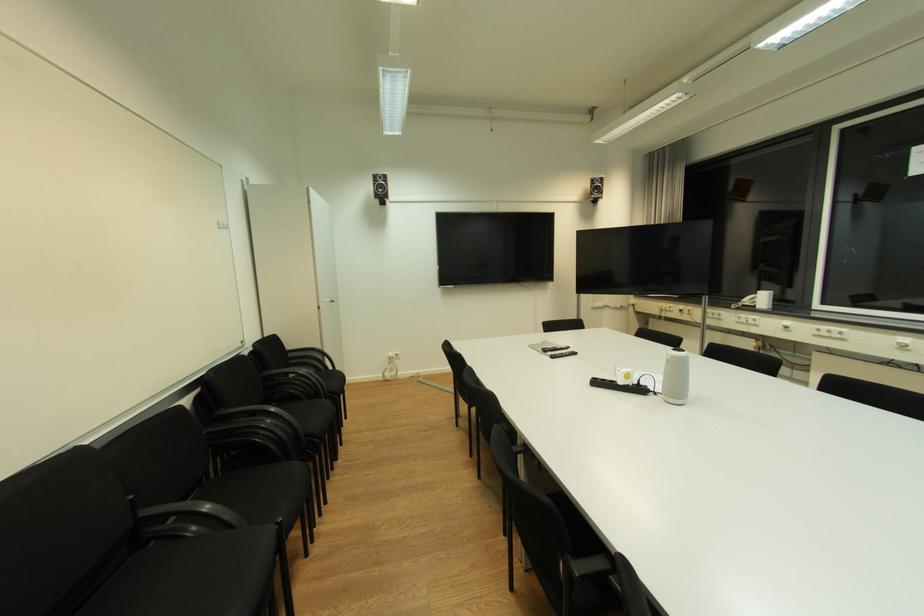
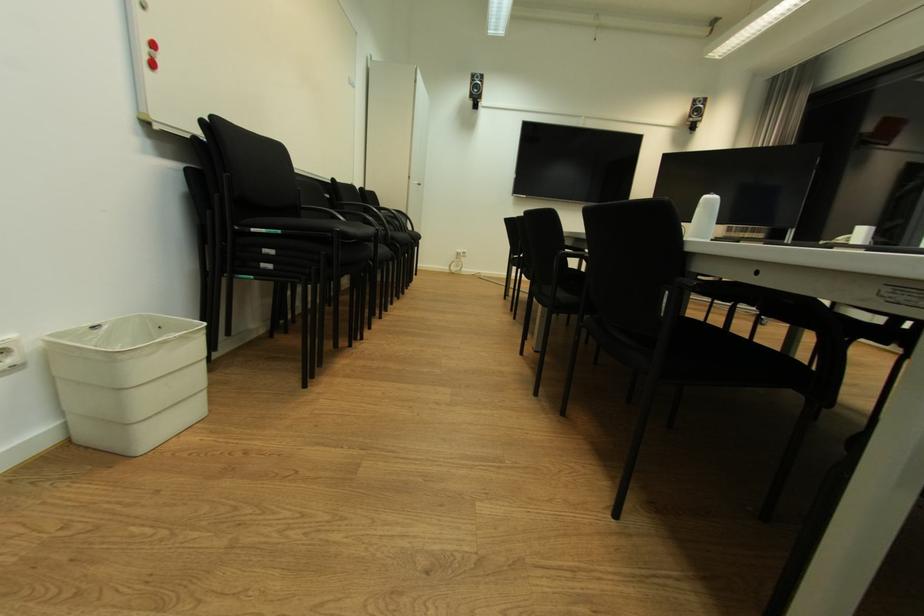
Based on the photo, what movement of the cameraman would produce the second image?

The cameraman moved toward right, backward.